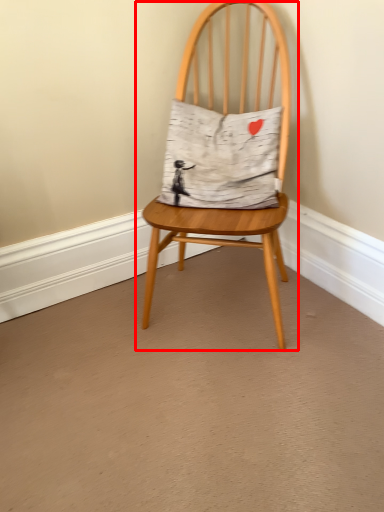
Question: Considering the relative positions of chair (annotated by the red box) and pillow in the image provided, where is chair (annotated by the red box) located with respect to the staircase?

Choices:
 (A) left
 (B) right

Answer: (B)